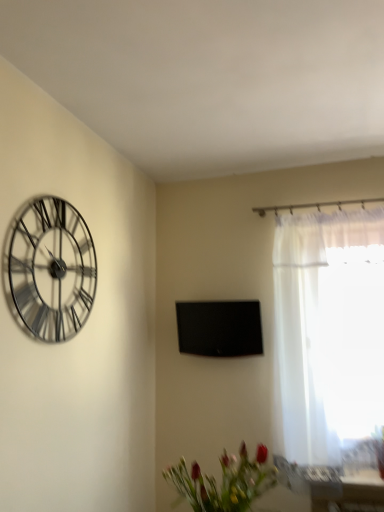
What do you see at coordinates (224, 482) in the screenshot? This screenshot has width=384, height=512. I see `matte green vase at lower center` at bounding box center [224, 482].

Image resolution: width=384 pixels, height=512 pixels. What do you see at coordinates (219, 328) in the screenshot?
I see `black glossy tv at center` at bounding box center [219, 328].

At what (x,y) coordinates should I click in order to perform the action: click on matte green vase at lower center. Please return your answer as a coordinate pair (x, y). Image resolution: width=384 pixels, height=512 pixels. Looking at the image, I should click on (224, 482).

Is metallic silver clock at upper left facing away from white sheer curtain at right?

metallic silver clock at upper left does not have its back to white sheer curtain at right.

From the image's perspective, is metallic silver clock at upper left positioned above or below white sheer curtain at right?

Based on their image positions, metallic silver clock at upper left is located above white sheer curtain at right.

Does metallic silver clock at upper left lie in front of white sheer curtain at right?

Yes, it is in front of white sheer curtain at right.

Considering the sizes of metallic silver clock at upper left and white sheer curtain at right in the image, is metallic silver clock at upper left bigger or smaller than white sheer curtain at right?

Considering their sizes, metallic silver clock at upper left takes up less space than white sheer curtain at right.

Is black glossy tv at center to the right of matte green vase at lower center from the viewer's perspective?

Yes, black glossy tv at center is to the right of matte green vase at lower center.

Consider the image. Does black glossy tv at center touch matte green vase at lower center?

black glossy tv at center and matte green vase at lower center are not in contact.

Is point (236, 311) positioned before point (206, 475)?

No, it is not.

From the image's perspective, which is above, black glossy tv at center or matte green vase at lower center?

black glossy tv at center appears higher in the image.

Is matte green vase at lower center taller or shorter than metallic silver clock at upper left?

matte green vase at lower center is shorter than metallic silver clock at upper left.

From a real-world perspective, is matte green vase at lower center below metallic silver clock at upper left?

Yes.

Consider the image. Considering the positions of objects matte green vase at lower center and metallic silver clock at upper left in the image provided, who is more to the right, matte green vase at lower center or metallic silver clock at upper left?

matte green vase at lower center is more to the right.

Is metallic silver clock at upper left completely or partially inside matte green vase at lower center?

No, metallic silver clock at upper left is not surrounded by matte green vase at lower center.

Can you tell me how much white sheer curtain at right and matte green vase at lower center differ in facing direction?

They differ by 92.1 degrees in their facing directions.

From the image's perspective, between white sheer curtain at right and matte green vase at lower center, who is located below?

From the image's view, matte green vase at lower center is below.

In terms of width, does white sheer curtain at right look wider or thinner when compared to matte green vase at lower center?

Considering their sizes, white sheer curtain at right looks slimmer than matte green vase at lower center.

I want to click on window on the right of matte green vase at lower center, so click(x=329, y=330).

The height and width of the screenshot is (512, 384). What are the coordinates of `window lying below the black glossy tv at center (from the image's perspective)` in the screenshot? It's located at (329, 330).

Which is behind, point (331, 395) or point (235, 333)?

Point (235, 333)

Is white sheer curtain at right wider or thinner than black glossy tv at center?

Clearly, white sheer curtain at right has more width compared to black glossy tv at center.

Between point (66, 316) and point (191, 486), which one is positioned in front?

The point (191, 486) is in front.

Can you tell me how much metallic silver clock at upper left and matte green vase at lower center differ in facing direction?

The angular difference between metallic silver clock at upper left and matte green vase at lower center is 1.56 degrees.

From a real-world perspective, which is physically below, metallic silver clock at upper left or matte green vase at lower center?

matte green vase at lower center, from a real-world perspective.

From the image's perspective, who appears lower, metallic silver clock at upper left or matte green vase at lower center?

matte green vase at lower center, from the image's perspective.

Does black glossy tv at center appear on the right side of white sheer curtain at right?

No.

Is black glossy tv at center oriented away from white sheer curtain at right?

No.

From a real-world perspective, between black glossy tv at center and white sheer curtain at right, who is vertically lower?

white sheer curtain at right, from a real-world perspective.

Is black glossy tv at center behind white sheer curtain at right?

That is True.

Where is `window below the metallic silver clock at upper left (from the image's perspective)`? The height and width of the screenshot is (512, 384). window below the metallic silver clock at upper left (from the image's perspective) is located at coordinates pos(329,330).

Where is `window screen above the matte green vase at lower center (from a real-world perspective)`? The height and width of the screenshot is (512, 384). window screen above the matte green vase at lower center (from a real-world perspective) is located at coordinates (219, 328).

From the image, which object appears to be farther from black glossy tv at center, metallic silver clock at upper left or white sheer curtain at right?

Based on the image, metallic silver clock at upper left appears to be further to black glossy tv at center.

Which object lies further to the anchor point white sheer curtain at right, metallic silver clock at upper left or matte green vase at lower center?

metallic silver clock at upper left is positioned further to the anchor white sheer curtain at right.

Considering their positions, is white sheer curtain at right positioned further to matte green vase at lower center than metallic silver clock at upper left?

Among the two, white sheer curtain at right is located further to matte green vase at lower center.

Which object lies nearer to the anchor point matte green vase at lower center, white sheer curtain at right or black glossy tv at center?

black glossy tv at center lies closer to matte green vase at lower center than the other object.

When comparing their distances from black glossy tv at center, does white sheer curtain at right or matte green vase at lower center seem further?

Based on the image, matte green vase at lower center appears to be further to black glossy tv at center.

Looking at the image, which one is located closer to matte green vase at lower center, metallic silver clock at upper left or white sheer curtain at right?

The object closer to matte green vase at lower center is metallic silver clock at upper left.

From the image, which object appears to be nearer to metallic silver clock at upper left, white sheer curtain at right or matte green vase at lower center?

matte green vase at lower center is closer to metallic silver clock at upper left.

Based on their spatial positions, is black glossy tv at center or white sheer curtain at right closer to metallic silver clock at upper left?

The object closer to metallic silver clock at upper left is black glossy tv at center.

Locate an element on the screen. window between matte green vase at lower center and black glossy tv at center along the z-axis is located at coordinates (329, 330).

The image size is (384, 512). I want to click on window screen situated between metallic silver clock at upper left and white sheer curtain at right from left to right, so click(219, 328).

What are the coordinates of `floral arrangement situated between metallic silver clock at upper left and white sheer curtain at right from left to right` in the screenshot? It's located at (224, 482).

Identify the location of wall clock between matte green vase at lower center and black glossy tv at center in the front-back direction. This screenshot has height=512, width=384. (51, 268).